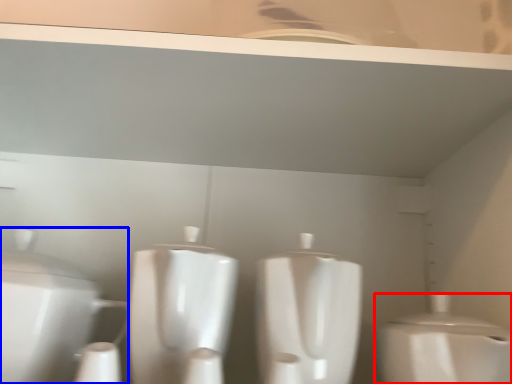
Question: Among these objects, which one is nearest to the camera, toilet (highlighted by a red box) or toilet (highlighted by a blue box)?

Choices:
 (A) toilet
 (B) toilet

Answer: (A)